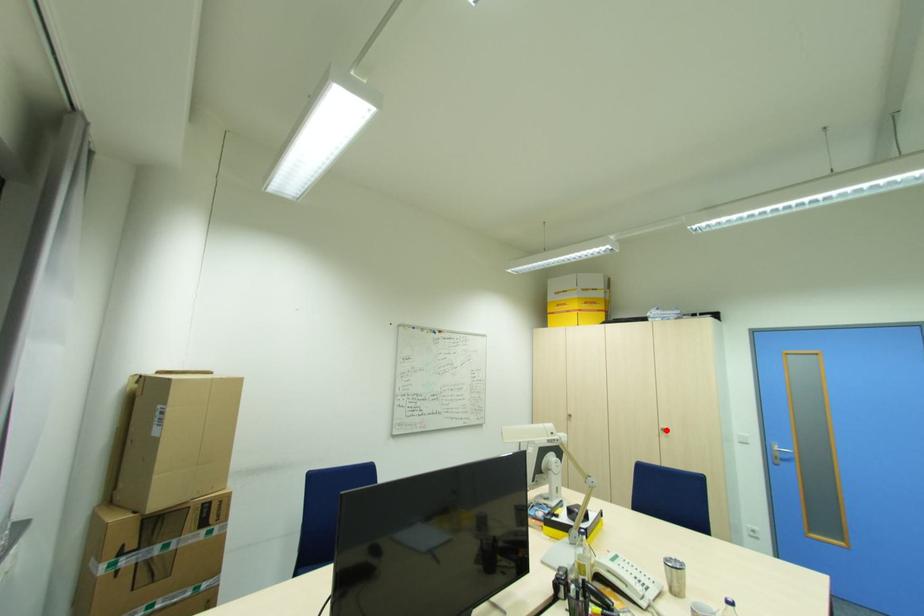
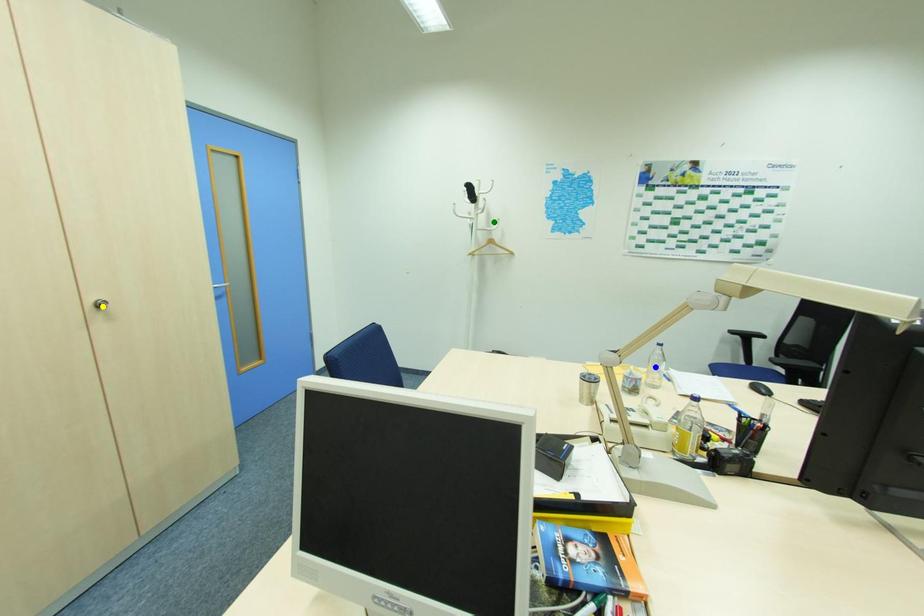
Question: I am providing you with two images of the same scene from different viewpoints. A red point is marked on the first image. You are given multiple points on the second image. Which mark in image 2 goes with the point in image 1?

Choices:
 (A) blue point
 (B) green point
 (C) yellow point

Answer: (C)